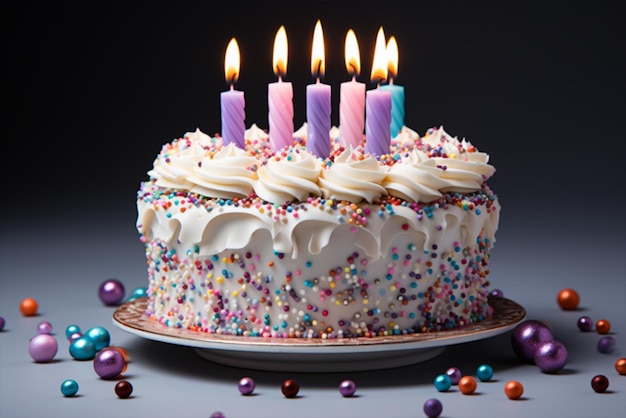
The width and height of the screenshot is (626, 418). What are the coordinates of `candles` in the screenshot? It's located at (228, 121), (275, 108), (314, 117), (346, 103), (372, 120), (393, 99).